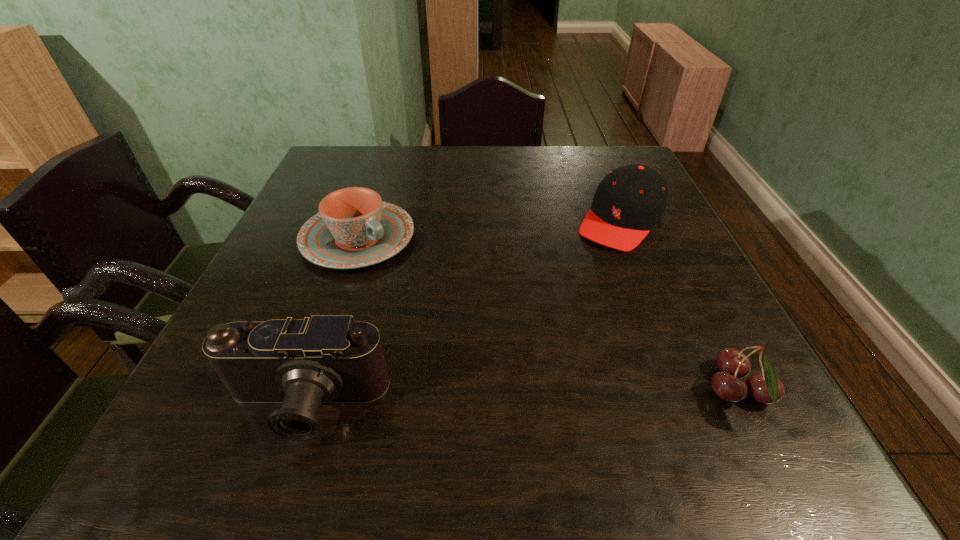
In order to click on vacant spot on the desktop that is between the camera and the cherry and is positioned on the front-facing side of the cap in this screenshot , I will do `click(471, 400)`.

Locate an element on the screen. free space on the desktop that is between the camera and the cherry and is positioned on the handle side of the chinaware is located at coordinates (588, 396).